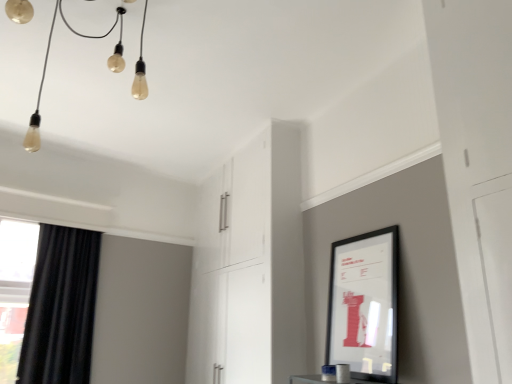
Question: From the image's perspective, is black matte picture frame at upper right located above matte glass lightbulbs at upper left?

Choices:
 (A) yes
 (B) no

Answer: (B)

Question: Is black matte picture frame at upper right closer to the viewer compared to matte glass lightbulbs at upper left?

Choices:
 (A) no
 (B) yes

Answer: (A)

Question: Does black matte picture frame at upper right have a lesser width compared to matte glass lightbulbs at upper left?

Choices:
 (A) yes
 (B) no

Answer: (A)

Question: Can we say black matte picture frame at upper right lies outside matte glass lightbulbs at upper left?

Choices:
 (A) no
 (B) yes

Answer: (B)

Question: Is black matte picture frame at upper right behind matte glass lightbulbs at upper left?

Choices:
 (A) yes
 (B) no

Answer: (A)

Question: Is matte glass lightbulbs at upper left at the back of black matte picture frame at upper right?

Choices:
 (A) no
 (B) yes

Answer: (A)

Question: Is black velvet curtain at left outside white glossy cabinet at center?

Choices:
 (A) no
 (B) yes

Answer: (B)

Question: Is black velvet curtain at left oriented away from white glossy cabinet at center?

Choices:
 (A) yes
 (B) no

Answer: (B)

Question: Can you confirm if black velvet curtain at left is thinner than white glossy cabinet at center?

Choices:
 (A) yes
 (B) no

Answer: (A)

Question: Can you confirm if black velvet curtain at left is wider than white glossy cabinet at center?

Choices:
 (A) yes
 (B) no

Answer: (B)

Question: From a real-world perspective, is black velvet curtain at left on top of white glossy cabinet at center?

Choices:
 (A) yes
 (B) no

Answer: (B)

Question: Is black velvet curtain at left positioned far away from white glossy cabinet at center?

Choices:
 (A) yes
 (B) no

Answer: (A)

Question: Is black matte picture frame at upper right directly adjacent to black velvet curtain at left?

Choices:
 (A) yes
 (B) no

Answer: (B)